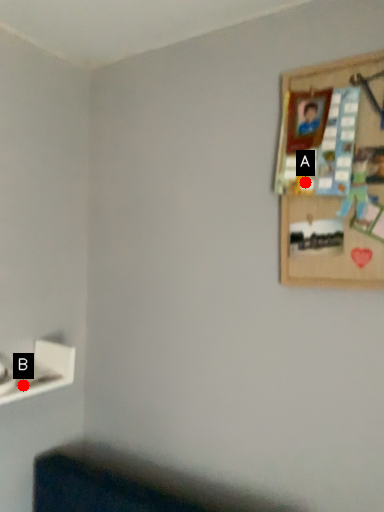
Question: Two points are circled on the image, labeled by A and B beside each circle. Which point is closer to the camera taking this photo?

Choices:
 (A) A is closer
 (B) B is closer

Answer: (A)